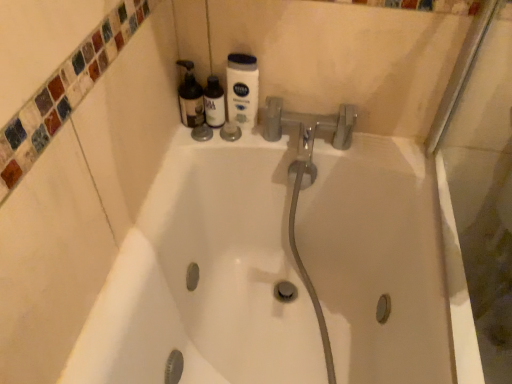
Question: From a real-world perspective, does translucent plastic bottle at upper center stand above white matte nivea lotion at upper center, marked as the 1th cleaning product in a right-to-left arrangement?

Choices:
 (A) yes
 (B) no

Answer: (B)

Question: From the image's perspective, is translucent plastic bottle at upper center over white matte nivea lotion at upper center, marked as the second cleaning product in a left-to-right arrangement?

Choices:
 (A) no
 (B) yes

Answer: (A)

Question: Is translucent plastic bottle at upper center further to the viewer compared to white matte nivea lotion at upper center, marked as the 1th cleaning product in a right-to-left arrangement?

Choices:
 (A) yes
 (B) no

Answer: (A)

Question: Is translucent plastic bottle at upper center turned away from white matte nivea lotion at upper center, marked as the second cleaning product in a left-to-right arrangement?

Choices:
 (A) yes
 (B) no

Answer: (B)

Question: Is translucent plastic bottle at upper center smaller than white matte nivea lotion at upper center, marked as the 1th cleaning product in a right-to-left arrangement?

Choices:
 (A) yes
 (B) no

Answer: (A)

Question: Is translucent plastic bottles at upper left, the first cleaning product in the left-to-right sequence, in front of or behind white matte nivea lotion at upper center, marked as the second cleaning product in a left-to-right arrangement, in the image?

Choices:
 (A) behind
 (B) front

Answer: (A)

Question: In terms of height, does translucent plastic bottles at upper left, the first cleaning product in the left-to-right sequence, look taller or shorter compared to white matte nivea lotion at upper center, marked as the second cleaning product in a left-to-right arrangement?

Choices:
 (A) short
 (B) tall

Answer: (A)

Question: From a real-world perspective, relative to white matte nivea lotion at upper center, marked as the 1th cleaning product in a right-to-left arrangement, is translucent plastic bottles at upper left, the first cleaning product in the left-to-right sequence, vertically above or below?

Choices:
 (A) below
 (B) above

Answer: (A)

Question: Considering the positions of translucent plastic bottles at upper left, marked as the 2th cleaning product in a right-to-left arrangement, and white matte nivea lotion at upper center, marked as the 1th cleaning product in a right-to-left arrangement, in the image, is translucent plastic bottles at upper left, marked as the 2th cleaning product in a right-to-left arrangement, wider or thinner than white matte nivea lotion at upper center, marked as the 1th cleaning product in a right-to-left arrangement,?

Choices:
 (A) wide
 (B) thin

Answer: (A)

Question: Choose the correct answer: Is white matte nivea lotion at upper center, marked as the second cleaning product in a left-to-right arrangement, inside translucent plastic bottles at upper left, marked as the 2th cleaning product in a right-to-left arrangement, or outside it?

Choices:
 (A) inside
 (B) outside

Answer: (B)

Question: From the image's perspective, is white matte nivea lotion at upper center, marked as the 1th cleaning product in a right-to-left arrangement, positioned above or below translucent plastic bottles at upper left, the first cleaning product in the left-to-right sequence?

Choices:
 (A) above
 (B) below

Answer: (B)

Question: Looking at their shapes, would you say white matte nivea lotion at upper center, marked as the second cleaning product in a left-to-right arrangement, is wider or thinner than translucent plastic bottles at upper left, marked as the 2th cleaning product in a right-to-left arrangement?

Choices:
 (A) wide
 (B) thin

Answer: (B)

Question: Would you say white matte nivea lotion at upper center, marked as the second cleaning product in a left-to-right arrangement, is to the left or to the right of translucent plastic bottles at upper left, marked as the 2th cleaning product in a right-to-left arrangement, in the picture?

Choices:
 (A) left
 (B) right

Answer: (B)

Question: From the image's perspective, is translucent plastic bottles at upper left, marked as the 2th cleaning product in a right-to-left arrangement, located above or below translucent plastic bottle at upper center?

Choices:
 (A) below
 (B) above

Answer: (B)

Question: Does point (181, 100) appear closer or farther from the camera than point (222, 112)?

Choices:
 (A) farther
 (B) closer

Answer: (B)